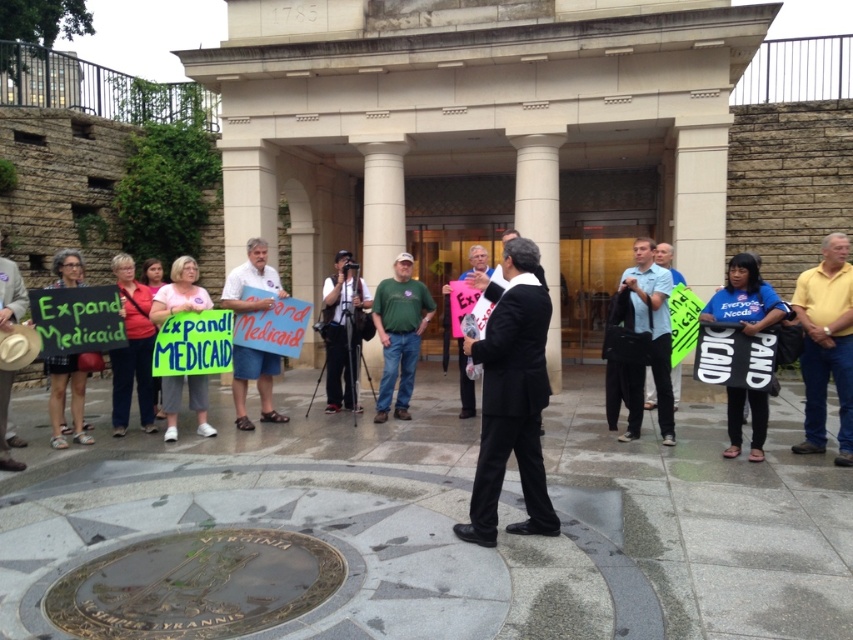
You are a photographer at the gathering and want to capture both the pink paper sign at center and the green plastic sign at center in one shot. Which sign should you position your camera closer to if you want the other sign to appear larger in the photo?

To make the green plastic sign at center appear larger in the photo, you should position your camera closer to the pink paper sign at center, since it is to the left of the green plastic sign at center.

You are standing at the center of the gathering and notice a yellow cotton shirt at right. If you want to move towards it, which direction should you walk?

Since the yellow cotton shirt at right is located at point 0.541 on the x and 0.970 on the y, you should walk to the right and slightly forward to reach it.